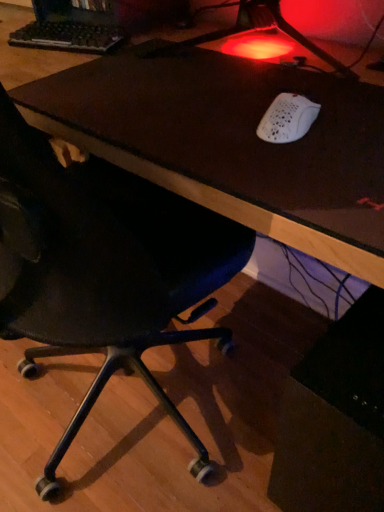
In order to click on vacant area that lies to the right of white matte mouse at upper right in this screenshot , I will do `click(350, 119)`.